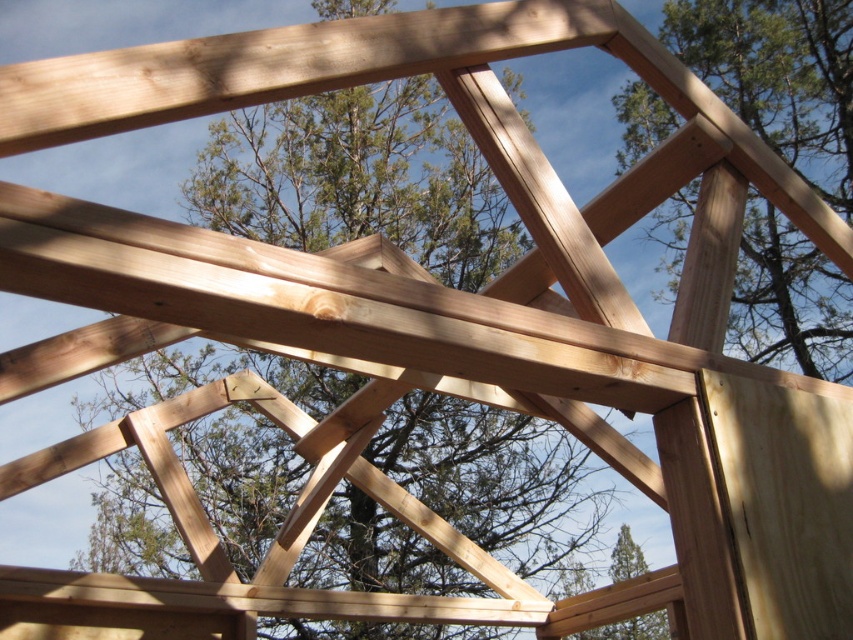
Between natural wood tree at center and natural wood post at upper right, which one appears on the right side from the viewer's perspective?

From the viewer's perspective, natural wood post at upper right appears more on the right side.

Which is more to the left, natural wood tree at center or natural wood post at upper right?

From the viewer's perspective, natural wood tree at center appears more on the left side.

Is point (479, 472) in front of point (804, 355)?

No, (479, 472) is further to viewer.

Image resolution: width=853 pixels, height=640 pixels. I want to click on natural wood tree at center, so click(358, 179).